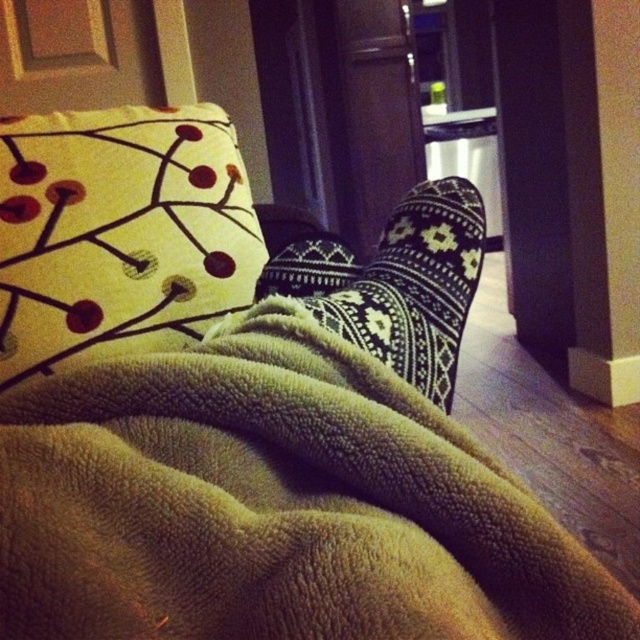
Question: Among these points, which one is nearest to the camera?

Choices:
 (A) (56, 150)
 (B) (461, 236)

Answer: (B)

Question: Is green fleece blanket at lower center above yellow fabric pillow at upper left?

Choices:
 (A) no
 (B) yes

Answer: (A)

Question: Based on their relative distances, which object is farther from the green fleece blanket at lower center?

Choices:
 (A) black knitted socks at center
 (B) yellow fabric pillow at upper left

Answer: (B)

Question: Is green fleece blanket at lower center positioned in front of yellow fabric pillow at upper left?

Choices:
 (A) no
 (B) yes

Answer: (B)

Question: Which point is farther to the camera?

Choices:
 (A) (76, 145)
 (B) (433, 368)

Answer: (A)

Question: Can you confirm if green fleece blanket at lower center is wider than black knitted socks at center?

Choices:
 (A) no
 (B) yes

Answer: (B)